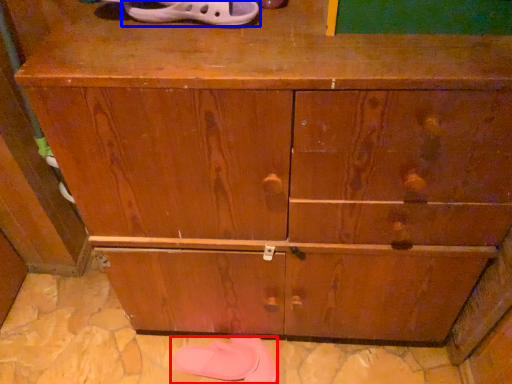
Question: Which object appears closest to the camera in this image, footwear (highlighted by a red box) or footwear (highlighted by a blue box)?

Choices:
 (A) footwear
 (B) footwear

Answer: (B)